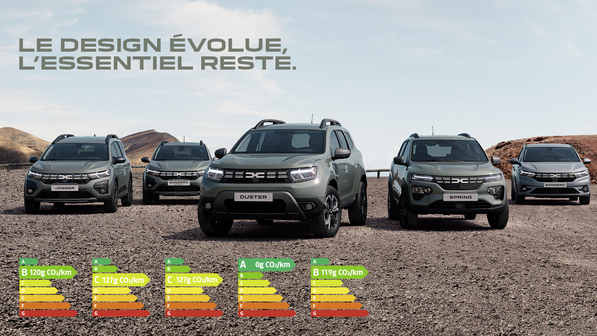
The height and width of the screenshot is (336, 597). I want to click on greenish-yellow bar, so click(32, 283), click(133, 277), click(184, 277), click(253, 282), click(323, 287).